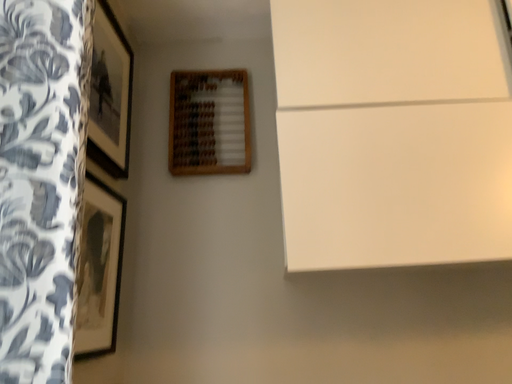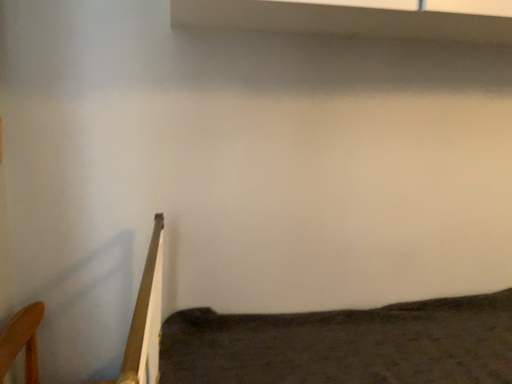
Question: How did the camera likely rotate when shooting the video?

Choices:
 (A) rotated upward
 (B) rotated downward

Answer: (B)